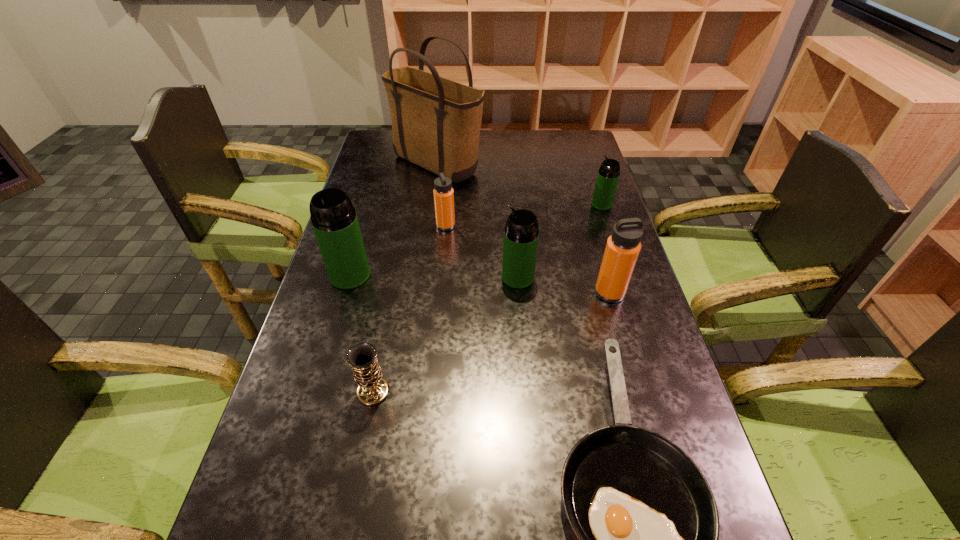
Locate an element on the screen. the left orange thermos bottle is located at coordinates (443, 193).

The image size is (960, 540). I want to click on the smaller orange thermos bottle, so coord(443,193).

I want to click on the second shortest object, so click(372, 390).

Locate an element on the screen. The image size is (960, 540). vacant space located on the front of the tallest object is located at coordinates (427, 245).

At what (x,y) coordinates should I click in order to perform the action: click on vacant space situated 0.400m from the spout of the tallest thermos bottle. Please return your answer as a coordinate pair (x, y). The image size is (960, 540). Looking at the image, I should click on click(303, 434).

The image size is (960, 540). I want to click on vacant space located from the spout of the third thermos bottle from right to left, so click(384, 277).

I want to click on vacant region located from the spout of the third thermos bottle from right to left, so click(384, 277).

In order to click on free space located from the spout of the third thermos bottle from right to left in this screenshot , I will do `click(414, 277)`.

In order to click on free space located 0.150m on the left of the right orange thermos bottle in this screenshot , I will do `click(538, 293)`.

At what (x,y) coordinates should I click in order to perform the action: click on vacant space located 0.140m from the spout of the seventh nearest object. Please return your answer as a coordinate pair (x, y). Image resolution: width=960 pixels, height=540 pixels. Looking at the image, I should click on (549, 204).